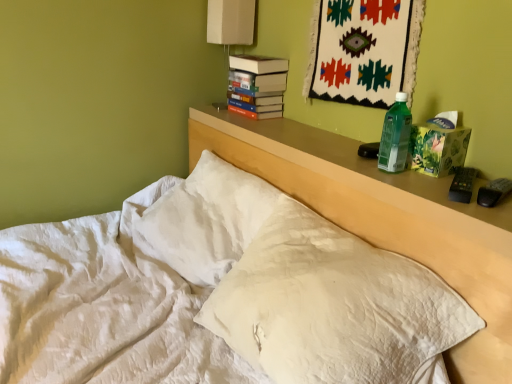
Question: Does green plastic bottle at right turn towards white quilted pillow at center?

Choices:
 (A) no
 (B) yes

Answer: (A)

Question: Is green plastic bottle at right shorter than white quilted pillow at center?

Choices:
 (A) no
 (B) yes

Answer: (B)

Question: Considering the relative sizes of green plastic bottle at right and white quilted pillow at center in the image provided, is green plastic bottle at right taller than white quilted pillow at center?

Choices:
 (A) no
 (B) yes

Answer: (A)

Question: Is green plastic bottle at right thinner than white quilted pillow at center?

Choices:
 (A) yes
 (B) no

Answer: (A)

Question: Is white quilted pillow at center completely or partially inside green plastic bottle at right?

Choices:
 (A) yes
 (B) no

Answer: (B)

Question: From the image's perspective, is white quilted pillow at center positioned above or below white quilted bed at center?

Choices:
 (A) above
 (B) below

Answer: (A)

Question: Is white quilted pillow at center to the left or to the right of white quilted bed at center in the image?

Choices:
 (A) left
 (B) right

Answer: (B)

Question: Considering the positions of point (274, 220) and point (453, 230), is point (274, 220) closer or farther from the camera than point (453, 230)?

Choices:
 (A) closer
 (B) farther

Answer: (B)

Question: In terms of width, does white quilted pillow at center look wider or thinner when compared to white quilted bed at center?

Choices:
 (A) wide
 (B) thin

Answer: (B)

Question: Is white quilted pillow at center wider or thinner than green plastic bottle at right?

Choices:
 (A) wide
 (B) thin

Answer: (A)

Question: Is point (312, 306) positioned closer to the camera than point (394, 140)?

Choices:
 (A) closer
 (B) farther

Answer: (A)

Question: Would you say white quilted pillow at center is to the left or to the right of green plastic bottle at right in the picture?

Choices:
 (A) left
 (B) right

Answer: (A)

Question: From a real-world perspective, is white quilted pillow at center above or below green plastic bottle at right?

Choices:
 (A) below
 (B) above

Answer: (A)

Question: From a real-world perspective, relative to white quilted bed at center, is green plastic bottle at right vertically above or below?

Choices:
 (A) above
 (B) below

Answer: (A)

Question: Considering the positions of point (386, 147) and point (200, 129), is point (386, 147) closer or farther from the camera than point (200, 129)?

Choices:
 (A) farther
 (B) closer

Answer: (B)